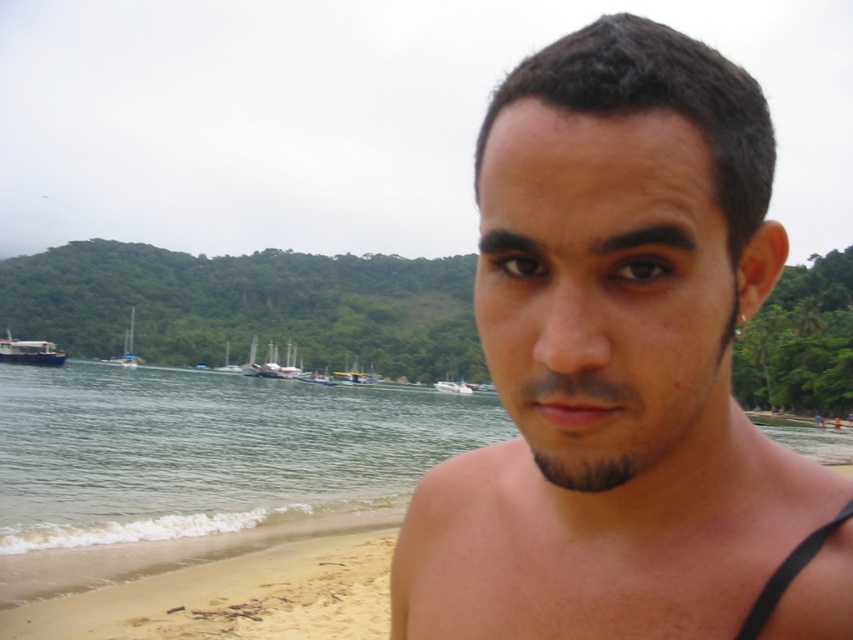
Which is more to the right, light tan sand at lower left or wooden sailboat at center?

light tan sand at lower left

Which of these two, light tan sand at lower left or wooden sailboat at center, stands shorter?

With less height is light tan sand at lower left.

Describe the element at coordinates (233, 596) in the screenshot. I see `light tan sand at lower left` at that location.

The image size is (853, 640). In order to click on light tan sand at lower left in this screenshot , I will do `click(233, 596)`.

The image size is (853, 640). Describe the element at coordinates (317, 378) in the screenshot. I see `white plastic boat at center` at that location.

Is white plastic boat at center below white glossy sailboat at center?

Yes.

The image size is (853, 640). I want to click on white plastic boat at center, so click(x=317, y=378).

Is brown matte skin at center closer to the viewer compared to light tan sand at lower left?

Yes.

Between brown matte skin at center and light tan sand at lower left, which one appears on the left side from the viewer's perspective?

Positioned to the left is light tan sand at lower left.

Is point (518, 588) closer to viewer compared to point (24, 628)?

Yes, point (518, 588) is closer to viewer.

Locate an element on the screen. brown matte skin at center is located at coordinates (614, 358).